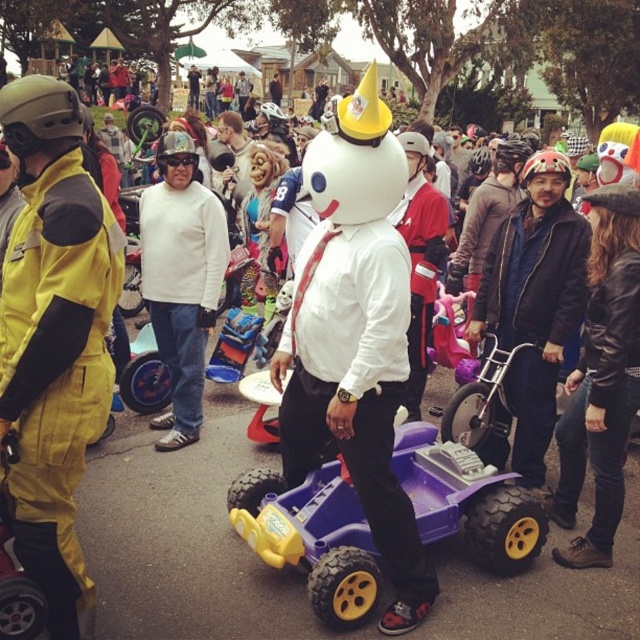
You are organizing a parade route for a childrens event and need to place a yellow matte jumpsuit at left and a purple plastic toy car at center along the path. Based on their positions, which object should be placed first as participants walk from left to right?

The yellow matte jumpsuit at left should be placed first since it is positioned on the left side of the purple plastic toy car at center, meaning participants would encounter it first when moving from left to right.